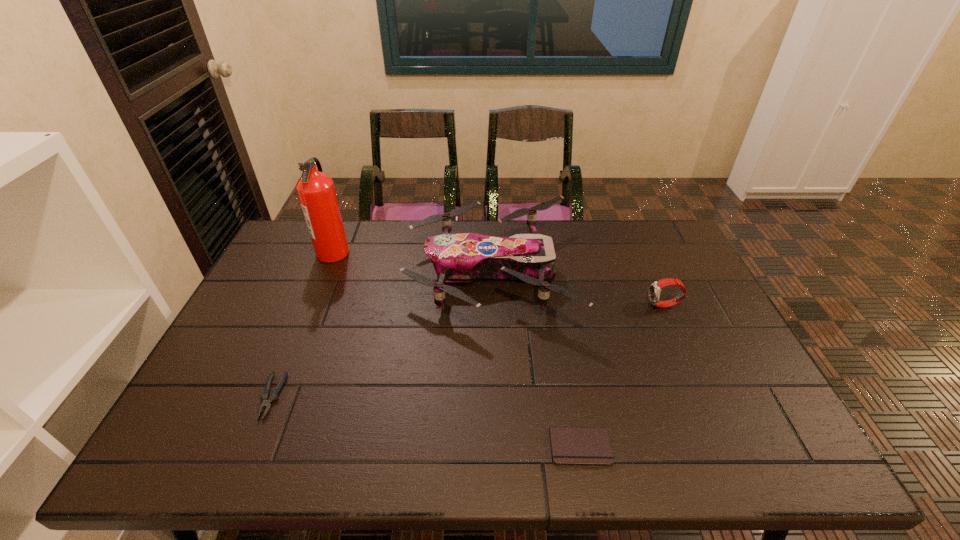
This screenshot has height=540, width=960. Identify the location of free region located on the front-facing side of the drone. point(339,273).

Where is `free location located on the front-facing side of the drone`? The width and height of the screenshot is (960, 540). free location located on the front-facing side of the drone is located at coordinates (302, 273).

Find the location of a particular element. The width and height of the screenshot is (960, 540). vacant space located 0.060m on the face of the third tallest object is located at coordinates (628, 306).

You are a GUI agent. You are given a task and a screenshot of the screen. Output one action in this format:
    pyautogui.click(x=<x>, y=<y>)
    Task: Click on the vacant region located on the face of the third tallest object
    The width and height of the screenshot is (960, 540).
    Given the screenshot: What is the action you would take?
    pyautogui.click(x=567, y=306)

This screenshot has height=540, width=960. In order to click on vacant area situated 0.360m on the face of the third tallest object in this screenshot , I will do `click(527, 306)`.

What are the coordinates of `free spot located at the gripping part of the fourth farthest object` in the screenshot? It's located at (252, 442).

Where is `free space located 0.210m on the right of the nearest object`? The height and width of the screenshot is (540, 960). free space located 0.210m on the right of the nearest object is located at coordinates (705, 447).

Where is `fire extinguisher present at the far edge`? fire extinguisher present at the far edge is located at coordinates (316, 191).

Find the location of a particular element. This screenshot has height=540, width=960. drone positioned at the far edge is located at coordinates (459, 257).

In order to click on object present at the near edge in this screenshot , I will do `click(591, 446)`.